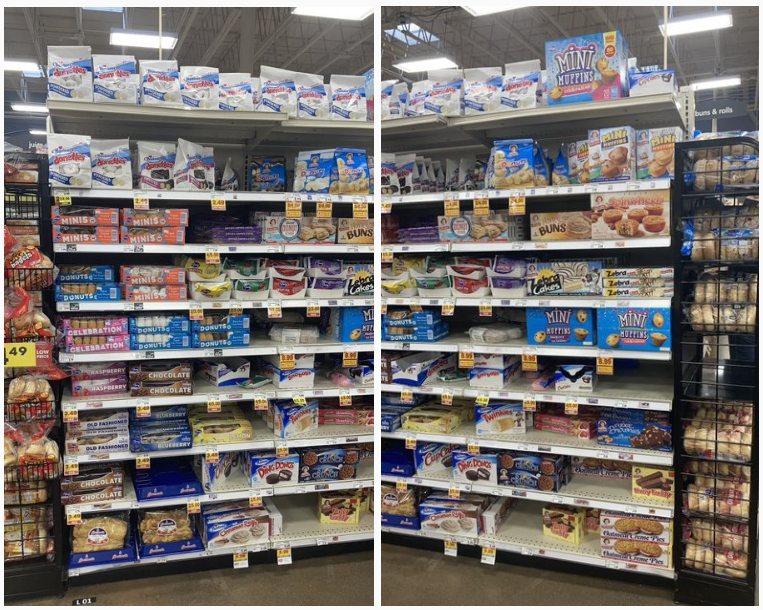
I want to click on floor, so click(449, 580), click(282, 584).